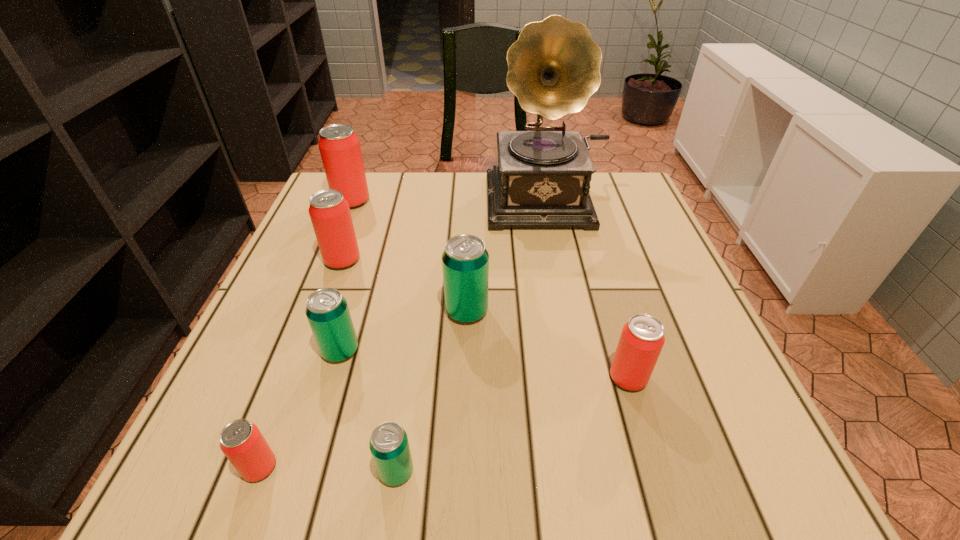
Locate an element on the screen. The image size is (960, 540). vacant space located on the back of the second nearest teal beer can is located at coordinates (366, 265).

The image size is (960, 540). In order to click on free space located on the right of the smallest teal beer can in this screenshot , I will do `click(619, 471)`.

Locate an element on the screen. vacant space located 0.400m on the right of the nearest red beer can is located at coordinates (548, 467).

Image resolution: width=960 pixels, height=540 pixels. I want to click on record player that is at the far edge, so click(542, 180).

In order to click on beer can that is positioned at the far edge in this screenshot , I will do `click(339, 146)`.

Where is `record player that is at the right edge`? This screenshot has height=540, width=960. record player that is at the right edge is located at coordinates (542, 180).

Identify the location of beer can that is at the right edge. This screenshot has width=960, height=540. (642, 338).

Where is `object that is at the far left corner`? Image resolution: width=960 pixels, height=540 pixels. object that is at the far left corner is located at coordinates (339, 146).

Identify the location of object that is at the near left corner. The height and width of the screenshot is (540, 960). (241, 441).

The width and height of the screenshot is (960, 540). I want to click on object positioned at the far right corner, so click(x=542, y=180).